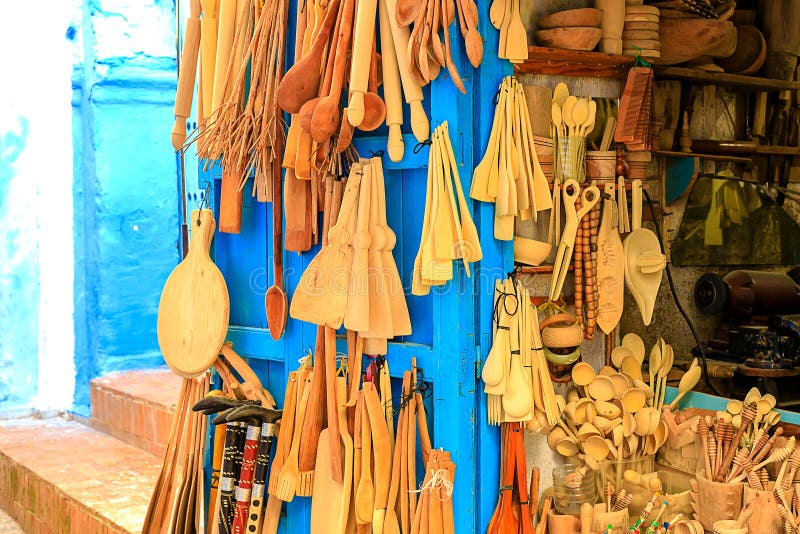
This screenshot has height=534, width=800. I want to click on hinge, so click(474, 363), click(481, 25).